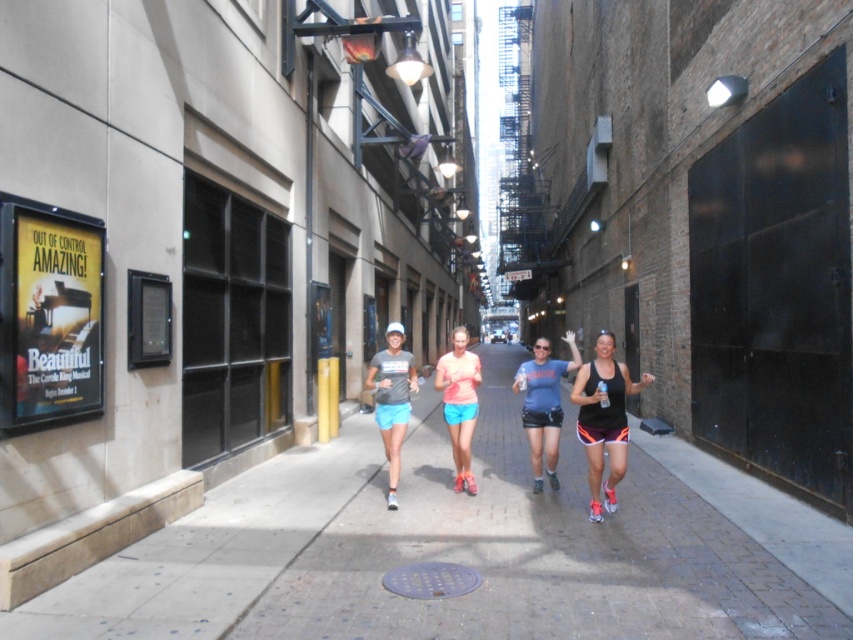
Does brick pavement at center have a lesser height compared to black matte tank top at right?

Indeed, brick pavement at center has a lesser height compared to black matte tank top at right.

You are a GUI agent. You are given a task and a screenshot of the screen. Output one action in this format:
    pyautogui.click(x=<x>, y=<y>)
    Task: Click on the brick pavement at center
    The image size is (853, 640).
    Given the screenshot: What is the action you would take?
    pyautogui.click(x=459, y=550)

Identify the location of brick pavement at center. (459, 550).

Which of these two, brick pavement at center or matte gray t-shirt at center, stands taller?

Standing taller between the two is matte gray t-shirt at center.

Is brick pavement at center positioned at the back of matte gray t-shirt at center?

That is False.

Is point (167, 531) farther from camera compared to point (395, 502)?

No, (167, 531) is closer to viewer.

Image resolution: width=853 pixels, height=640 pixels. I want to click on brick pavement at center, so point(459,550).

Does brick pavement at center lie behind matte coral tank top at center?

No.

Can you confirm if brick pavement at center is positioned to the right of matte coral tank top at center?

Indeed, brick pavement at center is positioned on the right side of matte coral tank top at center.

Is point (579, 470) in front of point (473, 371)?

No, it is not.

Locate an element on the screen. Image resolution: width=853 pixels, height=640 pixels. brick pavement at center is located at coordinates (459, 550).